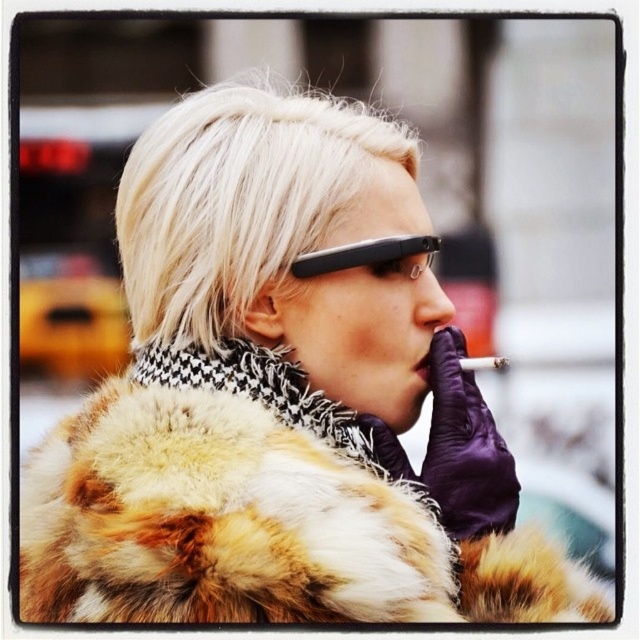
Does blonde fur at upper center have a smaller size compared to black plastic glasses at upper center?

No, blonde fur at upper center is not smaller than black plastic glasses at upper center.

What do you see at coordinates (236, 200) in the screenshot? I see `blonde fur at upper center` at bounding box center [236, 200].

At what (x,y) coordinates should I click in order to perform the action: click on blonde fur at upper center. Please return your answer as a coordinate pair (x, y). Looking at the image, I should click on (236, 200).

Is fur coat at center shorter than blonde fur at upper center?

Correct, fur coat at center is not as tall as blonde fur at upper center.

Is point (276, 371) closer to viewer compared to point (193, 112)?

Yes, it is in front of point (193, 112).

Find the location of a particular element. The image size is (640, 640). fur coat at center is located at coordinates (278, 504).

Does fur coat at center have a greater width compared to black plastic glasses at upper center?

Correct, the width of fur coat at center exceeds that of black plastic glasses at upper center.

Who is lower down, fur coat at center or black plastic glasses at upper center?

Positioned lower is fur coat at center.

Identify the location of fur coat at center. (278, 504).

Identify the location of fur coat at center. (278, 504).